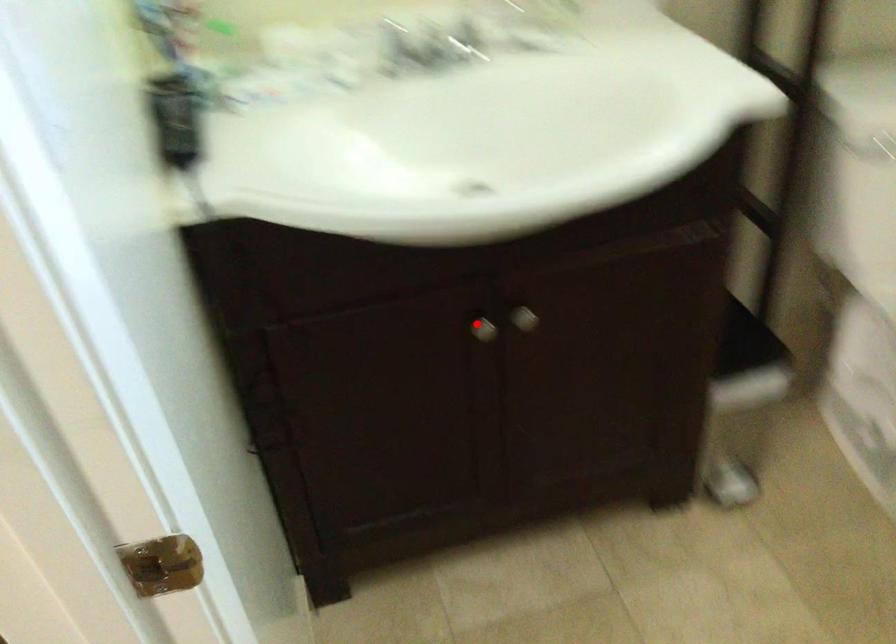
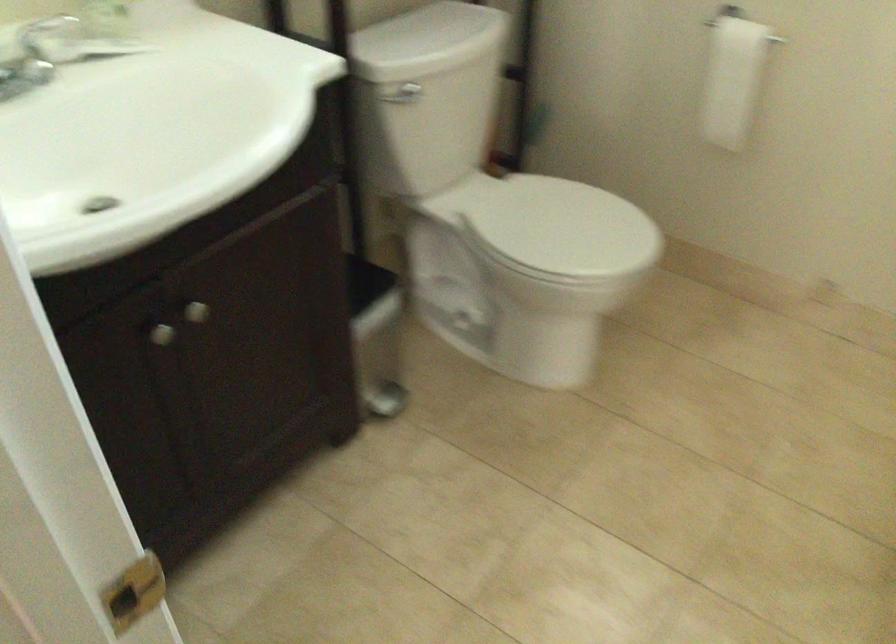
In the second image, find the point that corresponds to the highlighted location in the first image.

(161, 334)